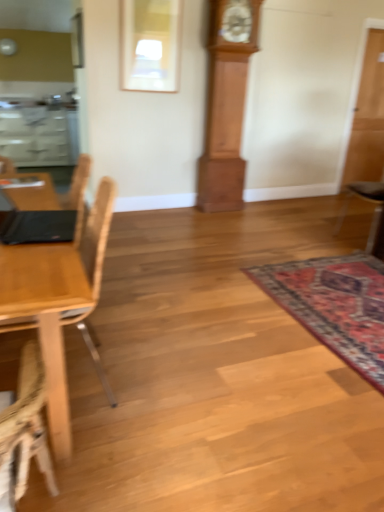
Where is `empty space that is in between wooden grandfather clock at center and light wood chair at left, marked as the 1th chair in a front-to-back arrangement`? This screenshot has width=384, height=512. empty space that is in between wooden grandfather clock at center and light wood chair at left, marked as the 1th chair in a front-to-back arrangement is located at coordinates (170, 270).